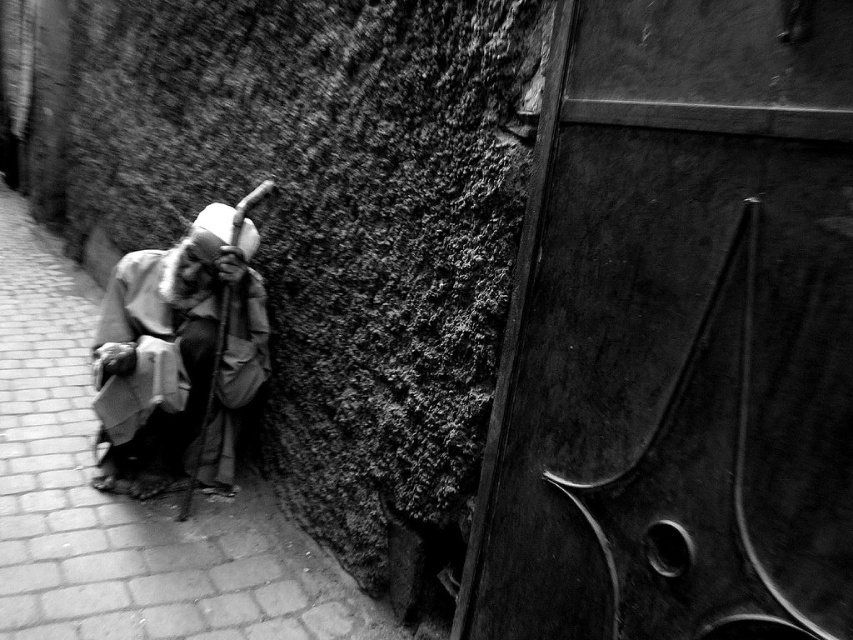
Question: Does brick pavement at left lie in front of gray fabric cloth at left?

Choices:
 (A) yes
 (B) no

Answer: (A)

Question: Does brick pavement at left have a smaller size compared to gray fabric cloth at left?

Choices:
 (A) yes
 (B) no

Answer: (B)

Question: Can you confirm if brick pavement at left is positioned above gray fabric cloth at left?

Choices:
 (A) no
 (B) yes

Answer: (A)

Question: Which object is farther from the camera taking this photo?

Choices:
 (A) gray fabric cloth at left
 (B) brick pavement at left

Answer: (A)

Question: Which point is closer to the camera?

Choices:
 (A) gray fabric cloth at left
 (B) brick pavement at left

Answer: (B)